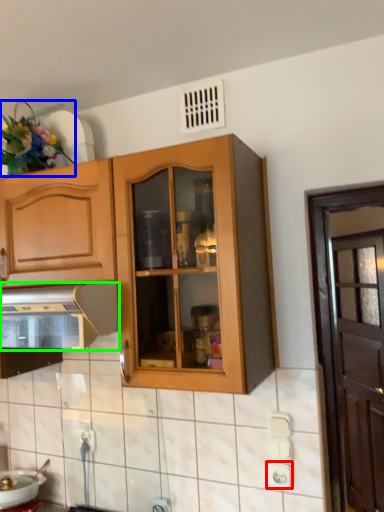
Question: Which object is positioned farthest from electric outlet (highlighted by a red box)? Select from flower (highlighted by a blue box) and kitchen appliance (highlighted by a green box).

Choices:
 (A) flower
 (B) kitchen appliance

Answer: (A)